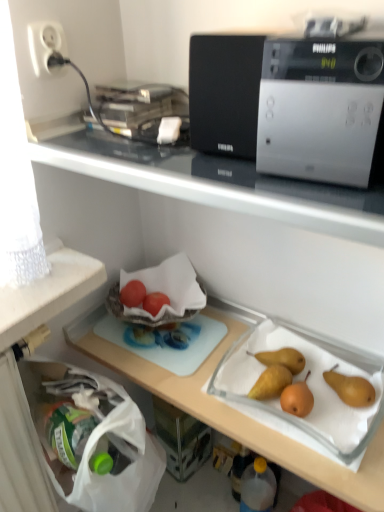
Find the location of a particular element. free location in front of matte red tomato at center-left, the 2th fruit from the right is located at coordinates (147, 341).